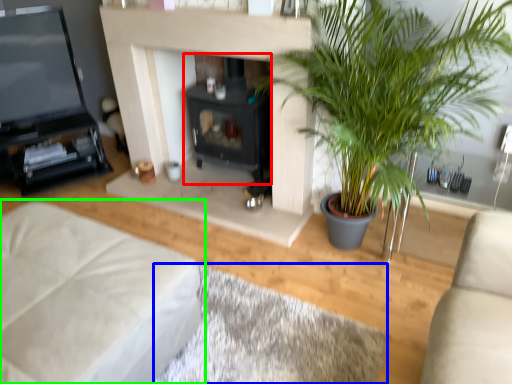
Question: Based on their relative distances, which object is nearer to fireplace (highlighted by a red box)? Choose from plain (highlighted by a blue box) and studio couch (highlighted by a green box).

Choices:
 (A) plain
 (B) studio couch

Answer: (A)